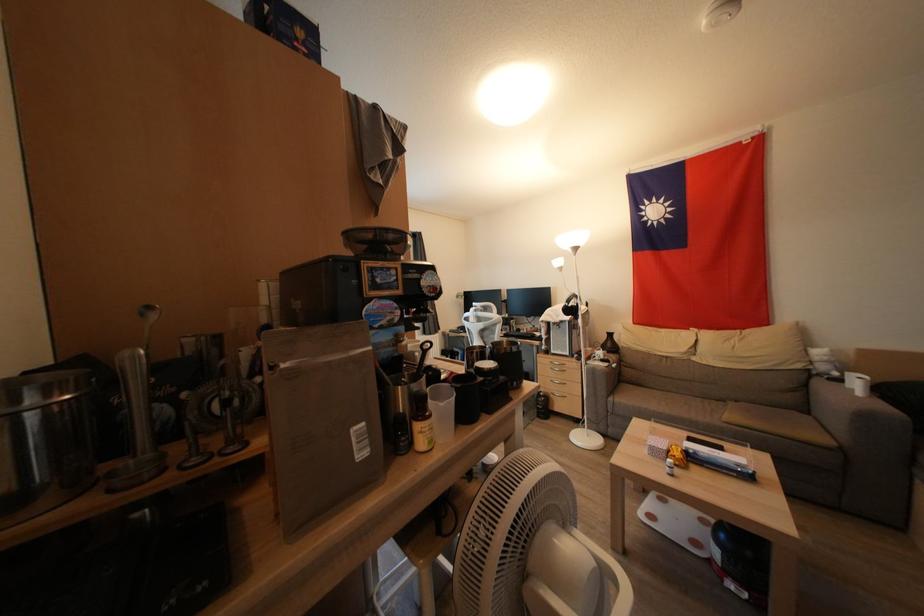
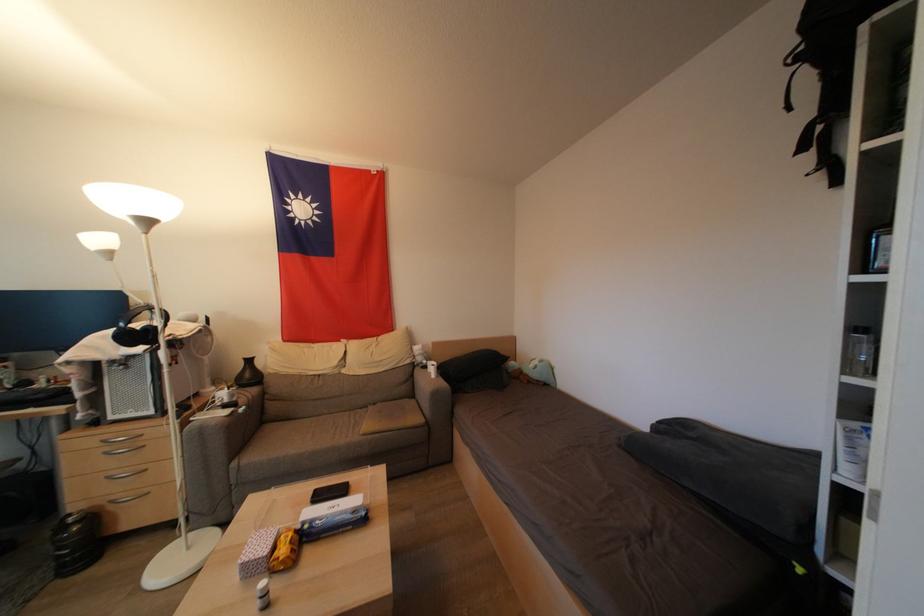
Locate, in the second image, the point that corresponds to (675,464) in the first image.

(268, 586)